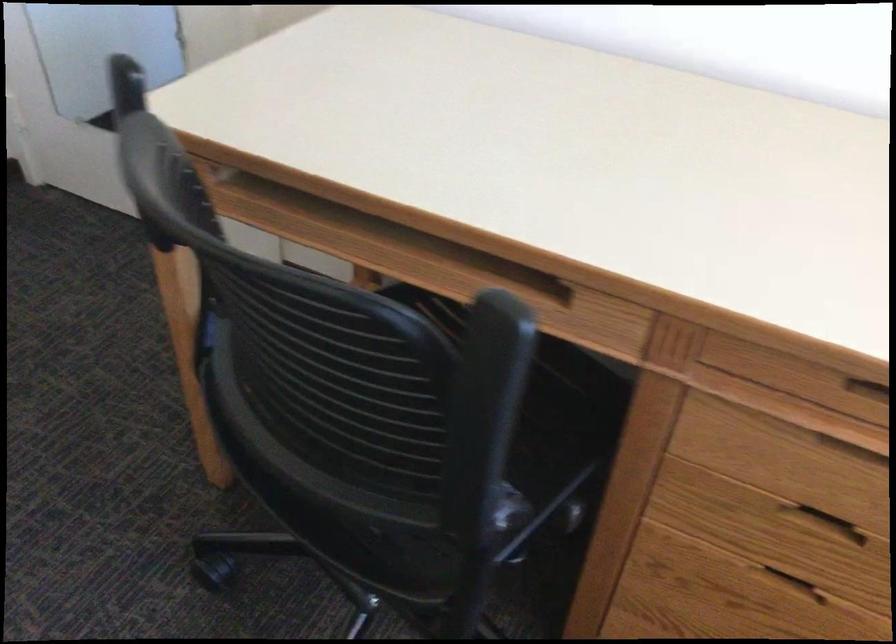
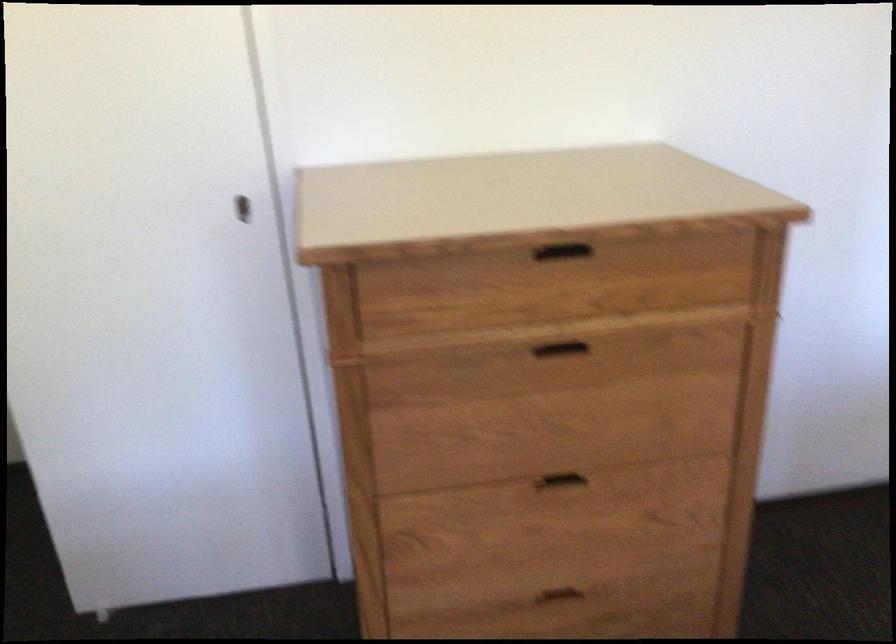
Question: The camera is either moving clockwise (left) or counter-clockwise (right) around the object. The first image is from the beginning of the video and the second image is from the end. Is the camera moving left or right when shooting the video?

Choices:
 (A) Left
 (B) Right

Answer: (B)